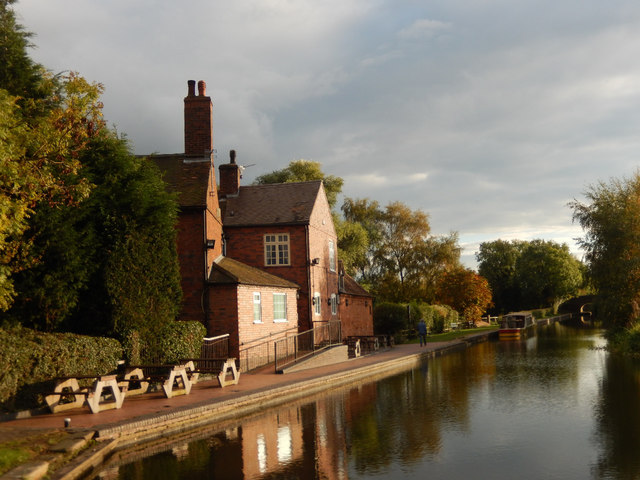
The image size is (640, 480). In order to click on table in this screenshot , I will do `click(214, 373)`, `click(164, 382)`, `click(107, 388)`.